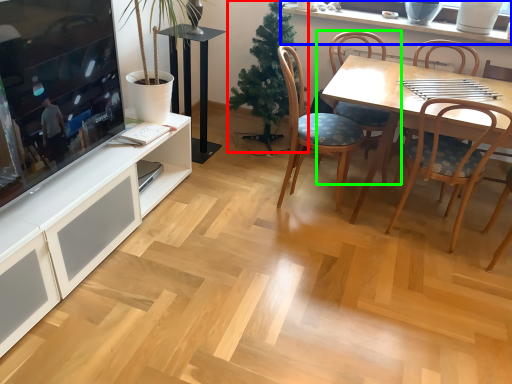
Question: Which is nearer to the christmas tree (highlighted by a red box)? window sill (highlighted by a blue box) or chair (highlighted by a green box).

Choices:
 (A) window sill
 (B) chair

Answer: (B)